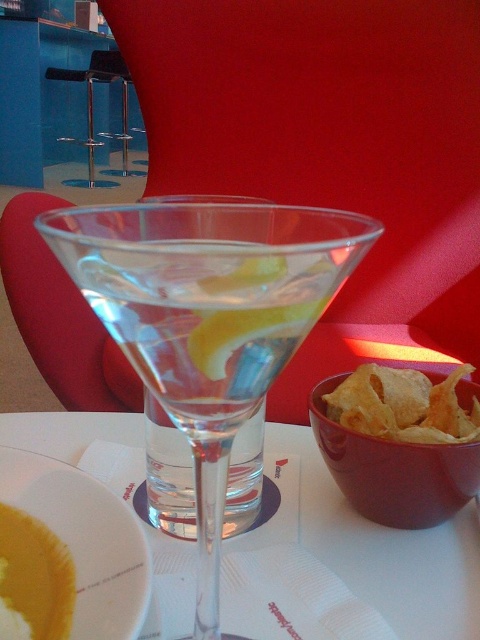
Image resolution: width=480 pixels, height=640 pixels. What do you see at coordinates (394, 472) in the screenshot?
I see `matte ceramic bowl at lower right` at bounding box center [394, 472].

Is matte ceramic bowl at lower right bigger than golden crispy chips at right?

Indeed, matte ceramic bowl at lower right has a larger size compared to golden crispy chips at right.

Which is behind, point (363, 440) or point (361, 376)?

The point (361, 376) is more distant.

Find the location of `matte ceramic bowl at lower right`. matte ceramic bowl at lower right is located at coordinates (394, 472).

Does transparent glass martini at center have a greater width compared to yellow matte plate at lower left?

Yes.

Does transparent glass martini at center lie in front of yellow matte plate at lower left?

That is True.

Identify the location of transparent glass martini at center. (207, 317).

Can you confirm if clear glass martini at center is shorter than yellow matte soup at lower left?

Incorrect, clear glass martini at center's height does not fall short of yellow matte soup at lower left's.

This screenshot has width=480, height=640. I want to click on clear glass martini at center, so click(x=168, y=474).

This screenshot has width=480, height=640. Describe the element at coordinates (168, 474) in the screenshot. I see `clear glass martini at center` at that location.

The image size is (480, 640). Identify the location of clear glass martini at center. (168, 474).